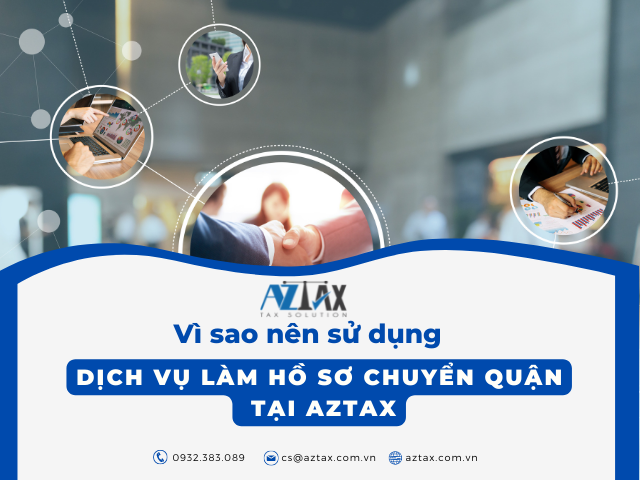
Where is `computers`? computers is located at coordinates (125, 137), (83, 100), (603, 191).